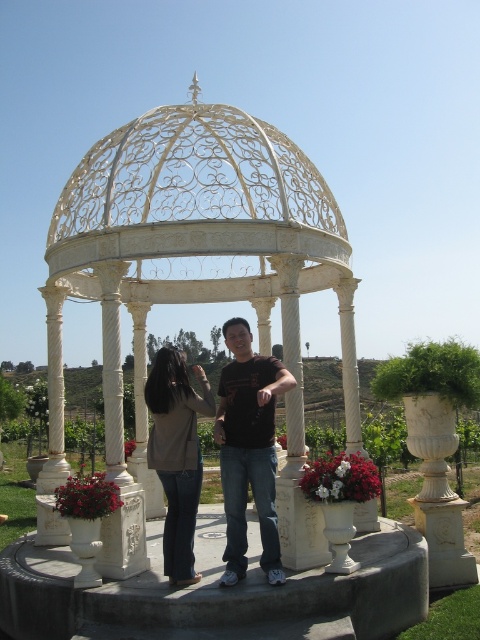
Consider the image. Is dark brown t-shirt at center taller than matte beige jacket at center?

Yes, dark brown t-shirt at center is taller than matte beige jacket at center.

Is dark brown t-shirt at center bigger than matte beige jacket at center?

Correct, dark brown t-shirt at center is larger in size than matte beige jacket at center.

The image size is (480, 640). I want to click on dark brown t-shirt at center, so click(249, 449).

Where is `dark brown t-shirt at center`? The image size is (480, 640). dark brown t-shirt at center is located at coordinates (249, 449).

Which is more to the left, white marble gazebo at center or dark brown t-shirt at center?

From the viewer's perspective, white marble gazebo at center appears more on the left side.

You are a GUI agent. You are given a task and a screenshot of the screen. Output one action in this format:
    pyautogui.click(x=<x>, y=<y>)
    Task: Click on the white marble gazebo at center
    
    Given the screenshot: What is the action you would take?
    pyautogui.click(x=204, y=257)

What are the coordinates of `white marble gazebo at center` in the screenshot? It's located at (204, 257).

Which of these two, white marble gazebo at center or matte beige jacket at center, stands taller?

white marble gazebo at center is taller.

Based on the photo, which is below, white marble gazebo at center or matte beige jacket at center?

Positioned lower is matte beige jacket at center.

Is point (151, 200) less distant than point (183, 528)?

No.

Where is `white marble gazebo at center`? white marble gazebo at center is located at coordinates pyautogui.click(x=204, y=257).